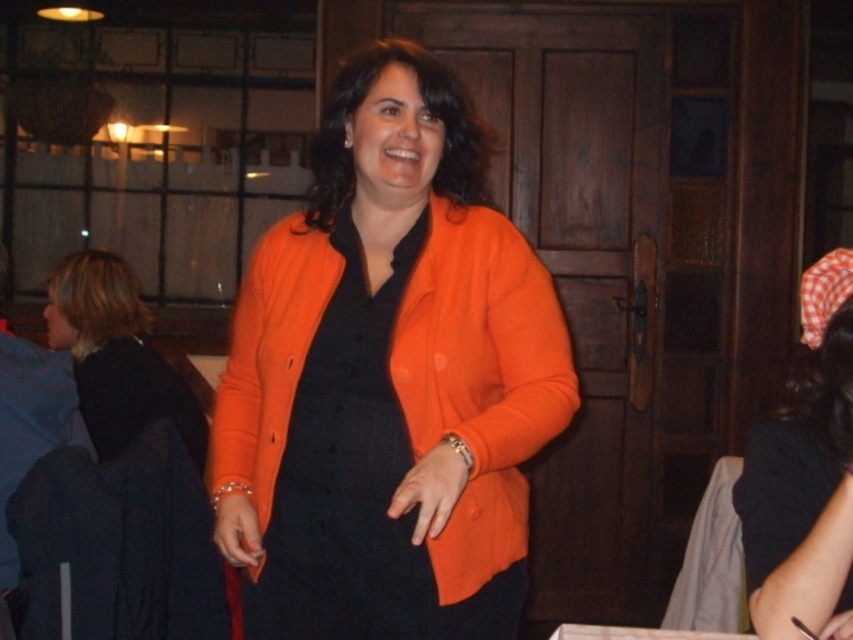
Consider the image. Is matte black dress at center thinner than orange matte blazer at center?

In fact, matte black dress at center might be wider than orange matte blazer at center.

Does point (426, 237) come in front of point (844, 401)?

No, it is behind (844, 401).

At what (x,y) coordinates should I click in order to perform the action: click on matte black dress at center. Please return your answer as a coordinate pair (x, y). Image resolution: width=853 pixels, height=640 pixels. Looking at the image, I should click on (345, 474).

Where is `orange matte blazer at center`? orange matte blazer at center is located at coordinates (805, 476).

Does point (831, 300) come farther from viewer compared to point (140, 330)?

No, (831, 300) is in front of (140, 330).

Between point (828, 472) and point (161, 410), which one is positioned in front?

Positioned in front is point (828, 472).

Image resolution: width=853 pixels, height=640 pixels. In order to click on orange matte blazer at center in this screenshot , I will do `click(805, 476)`.

How far apart are orange matte cardigan at center and black matte dress at left?

They are 4.42 feet apart.

This screenshot has height=640, width=853. What do you see at coordinates (387, 380) in the screenshot? I see `orange matte cardigan at center` at bounding box center [387, 380].

Locate an element on the screen. Image resolution: width=853 pixels, height=640 pixels. orange matte cardigan at center is located at coordinates (387, 380).